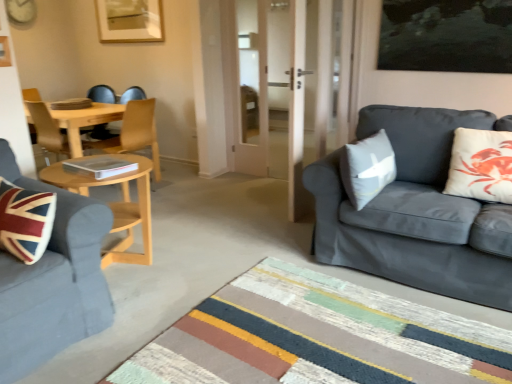
Question: Is gray fabric pillow at right, the 2th pillow when ordered from right to left, not close to dark gray fabric couch at right, the 1th studio couch positioned from the right?

Choices:
 (A) yes
 (B) no

Answer: (B)

Question: Is gray fabric pillow at right, the 2th pillow when ordered from right to left, further to camera compared to dark gray fabric couch at right, which appears as the 2th studio couch when viewed from the left?

Choices:
 (A) no
 (B) yes

Answer: (B)

Question: Could you tell me if gray fabric pillow at right, the 2th pillow when ordered from right to left, is facing dark gray fabric couch at right, which appears as the 2th studio couch when viewed from the left?

Choices:
 (A) yes
 (B) no

Answer: (A)

Question: From a real-world perspective, is gray fabric pillow at right, which is counted as the first pillow, starting from the left, physically below dark gray fabric couch at right, which appears as the 2th studio couch when viewed from the left?

Choices:
 (A) no
 (B) yes

Answer: (A)

Question: Is dark gray fabric couch at right, the 1th studio couch positioned from the right, surrounded by gray fabric pillow at right, the 2th pillow when ordered from right to left?

Choices:
 (A) yes
 (B) no

Answer: (B)

Question: Is gray fabric pillow at right, which is counted as the first pillow, starting from the left, shorter than dark gray fabric couch at right, the 1th studio couch positioned from the right?

Choices:
 (A) no
 (B) yes

Answer: (B)

Question: Is striped rug at center turned away from wooden chair at center?

Choices:
 (A) no
 (B) yes

Answer: (A)

Question: Can you confirm if striped rug at center is wider than wooden chair at center?

Choices:
 (A) no
 (B) yes

Answer: (B)

Question: Does striped rug at center turn towards wooden chair at center?

Choices:
 (A) yes
 (B) no

Answer: (B)

Question: From a real-world perspective, is striped rug at center located beneath wooden chair at center?

Choices:
 (A) no
 (B) yes

Answer: (B)

Question: Considering the relative positions of striped rug at center and wooden chair at center in the image provided, is striped rug at center to the right of wooden chair at center from the viewer's perspective?

Choices:
 (A) yes
 (B) no

Answer: (A)

Question: Considering the relative positions of striped rug at center and wooden chair at center in the image provided, is striped rug at center in front of wooden chair at center?

Choices:
 (A) no
 (B) yes

Answer: (B)

Question: From a real-world perspective, is velvet blue sofa at left, the 1th studio couch from the left, positioned under gray fabric pillow at right, which is counted as the first pillow, starting from the left, based on gravity?

Choices:
 (A) no
 (B) yes

Answer: (B)